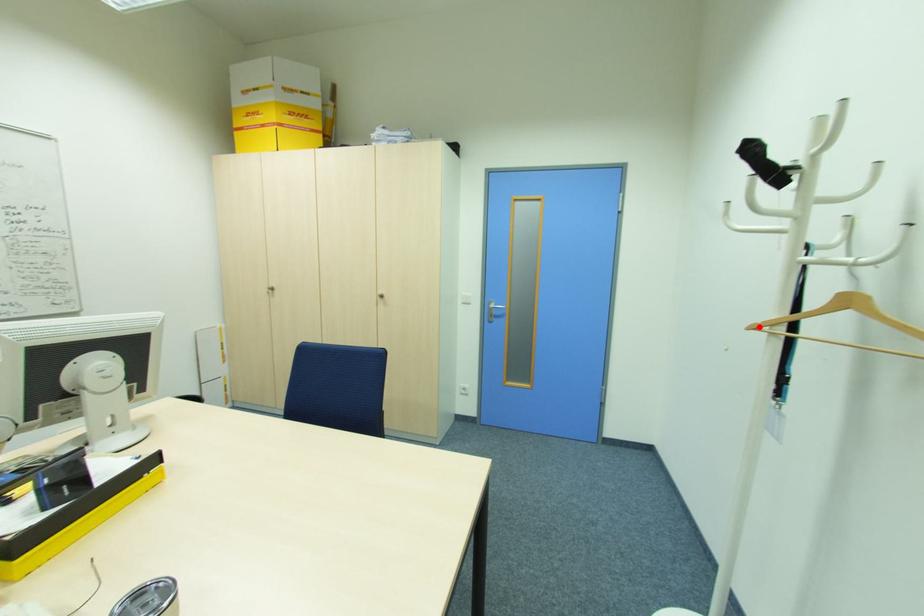
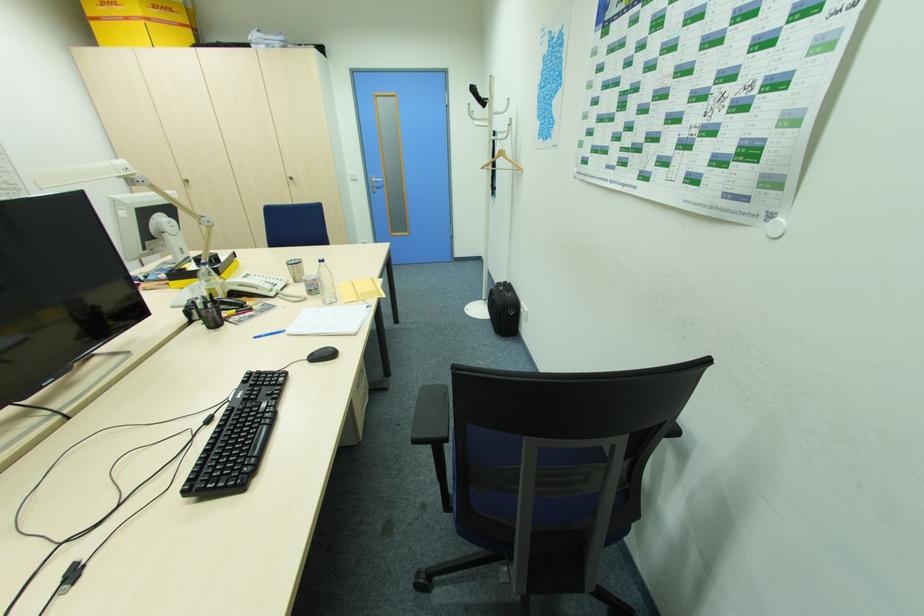
Where in the second image is the point corresponding to the highlighted location from the first image?

(485, 168)